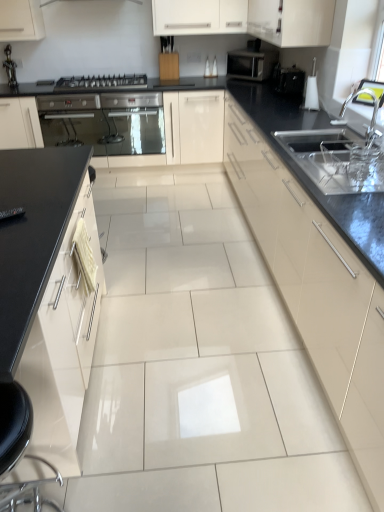
Locate an element on the screen. Image resolution: width=384 pixels, height=512 pixels. free space behind silver metallic faucet at upper right is located at coordinates (342, 139).